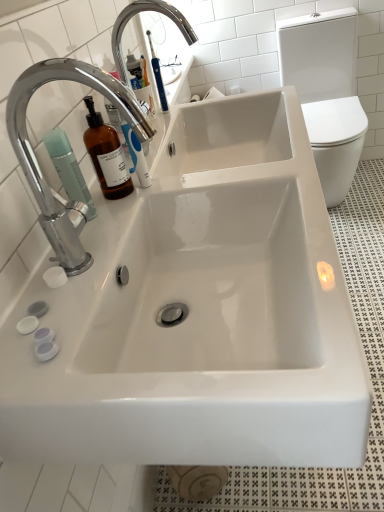
Question: Considering the relative sizes of chrome/metallic faucet at upper left, acting as the second tap starting from the top, and white glossy toilet bowl at right in the image provided, is chrome/metallic faucet at upper left, acting as the second tap starting from the top, taller than white glossy toilet bowl at right?

Choices:
 (A) yes
 (B) no

Answer: (B)

Question: Is chrome/metallic faucet at upper left, marked as the 1th tap in a front-to-back arrangement, wider than white glossy toilet bowl at right?

Choices:
 (A) no
 (B) yes

Answer: (A)

Question: Is chrome/metallic faucet at upper left, the second tap when ordered from back to front, oriented away from white glossy toilet bowl at right?

Choices:
 (A) yes
 (B) no

Answer: (B)

Question: Is white glossy toilet bowl at right a part of chrome/metallic faucet at upper left, the second tap when ordered from back to front?

Choices:
 (A) yes
 (B) no

Answer: (B)

Question: Considering the relative sizes of chrome/metallic faucet at upper left, the first tap in the bottom-to-top sequence, and white glossy toilet bowl at right in the image provided, is chrome/metallic faucet at upper left, the first tap in the bottom-to-top sequence, thinner than white glossy toilet bowl at right?

Choices:
 (A) yes
 (B) no

Answer: (A)

Question: Can you confirm if chrome/metallic faucet at upper left, acting as the second tap starting from the top, is positioned to the left of white glossy toilet bowl at right?

Choices:
 (A) yes
 (B) no

Answer: (A)

Question: Would you say chrome/metallic faucet at upper left, marked as the 1th tap in a front-to-back arrangement, is part of matte green pump bottle at left's contents?

Choices:
 (A) yes
 (B) no

Answer: (B)

Question: Can you confirm if matte green pump bottle at left is positioned to the left of chrome/metallic faucet at upper left, marked as the 1th tap in a front-to-back arrangement?

Choices:
 (A) no
 (B) yes

Answer: (B)

Question: Is matte green pump bottle at left facing towards chrome/metallic faucet at upper left, acting as the second tap starting from the top?

Choices:
 (A) yes
 (B) no

Answer: (B)

Question: Considering the relative sizes of matte green pump bottle at left and chrome/metallic faucet at upper left, the first tap in the bottom-to-top sequence, in the image provided, is matte green pump bottle at left taller than chrome/metallic faucet at upper left, the first tap in the bottom-to-top sequence,?

Choices:
 (A) no
 (B) yes

Answer: (A)

Question: Does matte green pump bottle at left come in front of chrome/metallic faucet at upper left, the second tap when ordered from back to front?

Choices:
 (A) yes
 (B) no

Answer: (B)

Question: Does matte green pump bottle at left appear on the right side of chrome/metallic faucet at upper left, the second tap when ordered from back to front?

Choices:
 (A) no
 (B) yes

Answer: (A)

Question: From a real-world perspective, does white glossy toilet bowl at right sit lower than chrome/metallic faucet at upper left, the first tap in the bottom-to-top sequence?

Choices:
 (A) no
 (B) yes

Answer: (B)